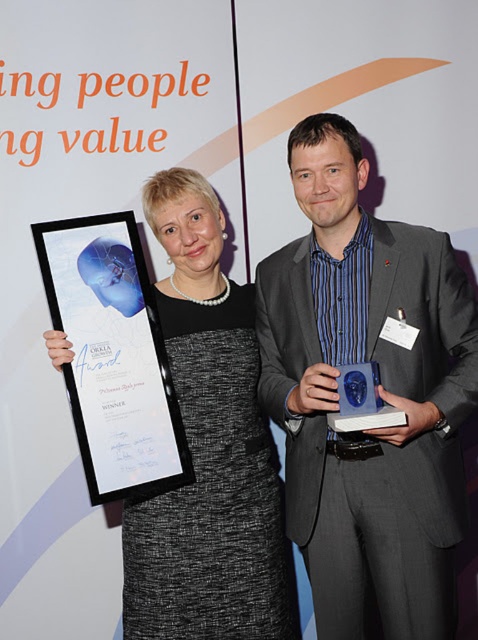
You are an event organizer who needs to place a new decorative item between the matte gray suit at center and the black glossy plaque at left. The new item must be smaller than both. Which object should you use as a reference for the maximum size of the new item?

The black glossy plaque at left is smaller than the matte gray suit at center, so you should use the black glossy plaque at left as the reference for the maximum size of the new item to ensure it is smaller than both.

You are an event coordinator arranging a photo shoot. You need to place a new decorative item between the matte gray suit at center and the black glossy plaque at left. Based on their current positions, where should the new item be placed?

The new decorative item should be placed between the matte gray suit at center and the black glossy plaque at left, as the matte gray suit at center is to the right of the black glossy plaque at left.